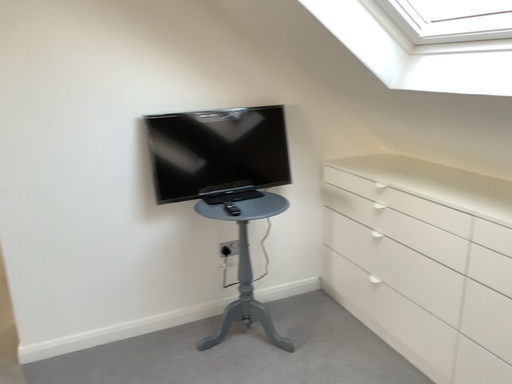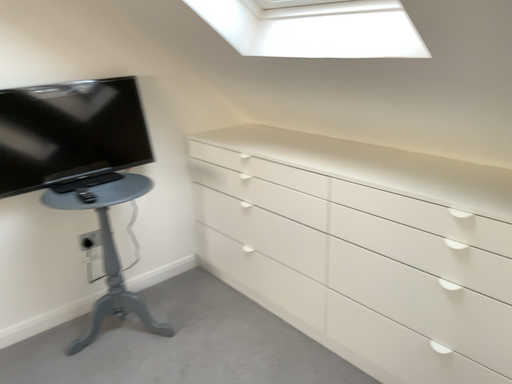
Question: Which way did the camera rotate in the video?

Choices:
 (A) rotated right
 (B) rotated left

Answer: (A)